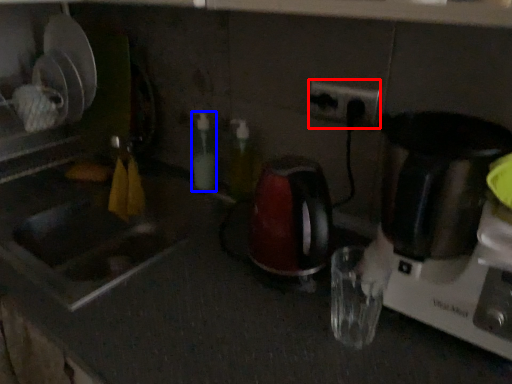
Question: Which object appears farthest to the camera in this image, electric outlet (highlighted by a red box) or bottle (highlighted by a blue box)?

Choices:
 (A) electric outlet
 (B) bottle

Answer: (B)